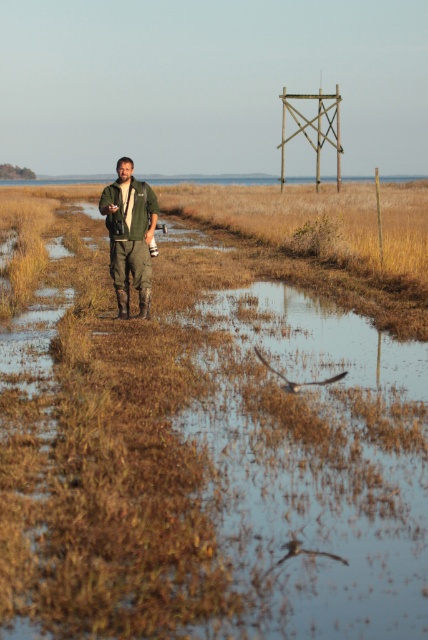
Is point (290, 234) farther from camera compared to point (122, 234)?

Yes.

The width and height of the screenshot is (428, 640). In order to click on brown grassy wetland at center in this screenshot , I will do `click(214, 420)`.